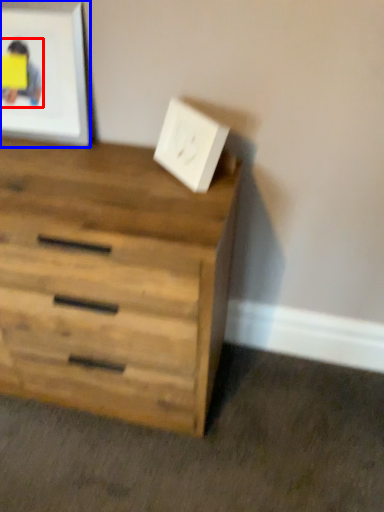
Question: Which object appears farthest to the camera in this image, person (highlighted by a red box) or picture frame (highlighted by a blue box)?

Choices:
 (A) person
 (B) picture frame

Answer: (A)